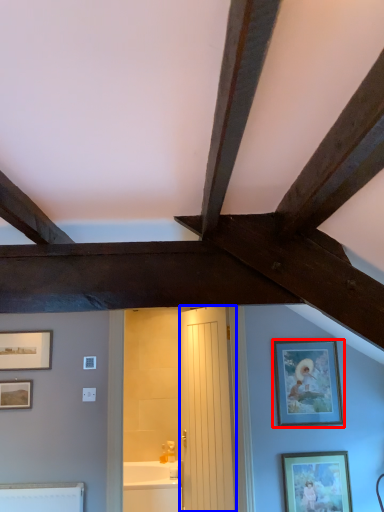
Question: Which of the following is the closest to the observer, picture frame (highlighted by a red box) or door (highlighted by a blue box)?

Choices:
 (A) picture frame
 (B) door

Answer: (B)